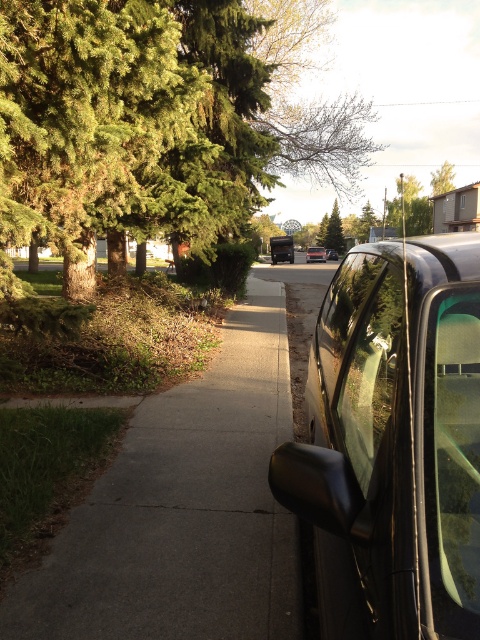
Does gray concrete sidewalk at center have a greater width compared to transparent glass window at right?

Yes.

Is gray concrete sidewalk at center thinner than transparent glass window at right?

No, gray concrete sidewalk at center is not thinner than transparent glass window at right.

This screenshot has height=640, width=480. What are the coordinates of `gray concrete sidewalk at center` in the screenshot? It's located at (183, 509).

The image size is (480, 640). Find the location of `gray concrete sidewalk at center`. gray concrete sidewalk at center is located at coordinates (183, 509).

Identify the location of green matte tree at center. Image resolution: width=480 pixels, height=640 pixels. (334, 230).

Can you confirm if green matte tree at center is shorter than satin black sedan at center?

In fact, green matte tree at center may be taller than satin black sedan at center.

Where is `green matte tree at center`? The height and width of the screenshot is (640, 480). green matte tree at center is located at coordinates (334, 230).

Who is more forward, (68, 525) or (335, 214)?

Point (68, 525)

Consider the image. How much distance is there between gray concrete sidewalk at center and green matte tree at center?

gray concrete sidewalk at center is 175.36 feet from green matte tree at center.

Where is `gray concrete sidewalk at center`? This screenshot has width=480, height=640. gray concrete sidewalk at center is located at coordinates (183, 509).